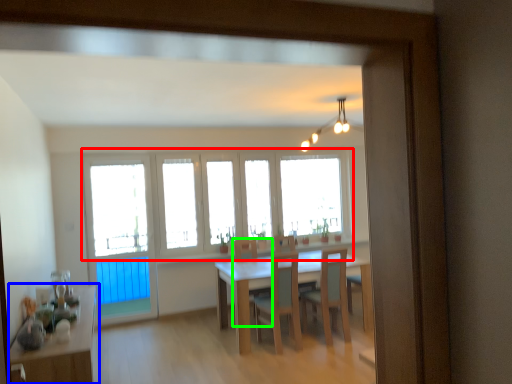
Question: Which is farther away from window (highlighted by a red box)? table (highlighted by a blue box) or armchair (highlighted by a green box)?

Choices:
 (A) table
 (B) armchair

Answer: (A)